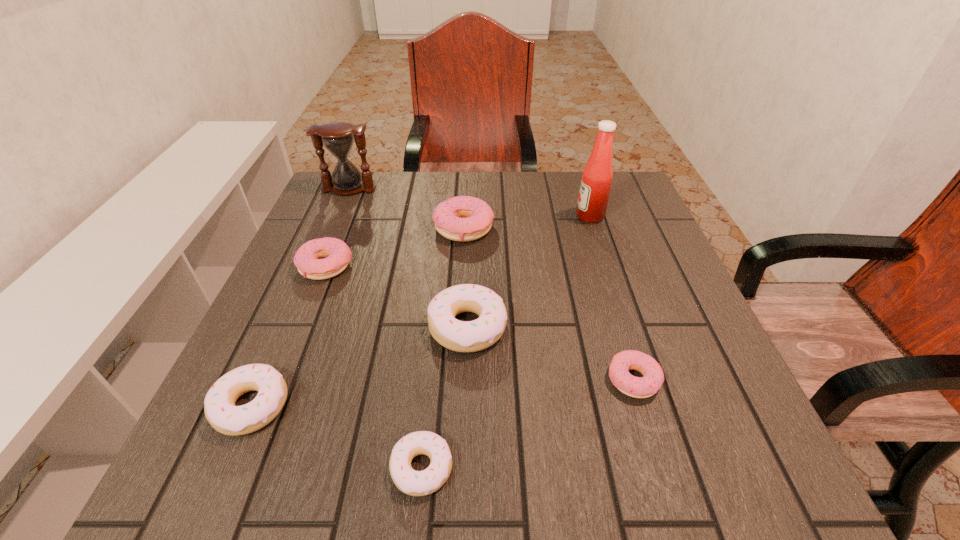
You are a GUI agent. You are given a task and a screenshot of the screen. Output one action in this format:
    pyautogui.click(x=<x>, y=<y>)
    Task: Click on the free space between the farthest white doughnut and the farthest doughnut
    The image size is (960, 540).
    Given the screenshot: What is the action you would take?
    [x=466, y=278]

The image size is (960, 540). What are the coordinates of `free spot between the second biggest white doughnut and the biggest white doughnut` in the screenshot? It's located at (359, 367).

Where is `free space that is in between the farthest white doughnut and the second pink doughnut from left to right`? The width and height of the screenshot is (960, 540). free space that is in between the farthest white doughnut and the second pink doughnut from left to right is located at coordinates (466, 278).

The image size is (960, 540). Identify the location of vacant space that is in between the nearest pink doughnut and the leftmost white doughnut. (443, 393).

Identify the location of object that is the third closest to the second biggest white doughnut. (337, 255).

Locate which object is the third closest to the nearest pink doughnut. Please provide its 2D coordinates. Your answer should be formatted as a tuple, i.e. [(x, y)], where the tuple contains the x and y coordinates of a point satisfying the conditions above.

[(463, 218)]

Point out which doughnut is positioned as the nearest to the smallest white doughnut. Please provide its 2D coordinates. Your answer should be formatted as a tuple, i.e. [(x, y)], where the tuple contains the x and y coordinates of a point satisfying the conditions above.

[(470, 336)]

Identify the location of doughnut object that ranks as the fourth closest to the seventh shortest object. Image resolution: width=960 pixels, height=540 pixels. (219, 405).

Locate which pink doughnut is the second closest to the leftmost white doughnut. Please provide its 2D coordinates. Your answer should be formatted as a tuple, i.e. [(x, y)], where the tuple contains the x and y coordinates of a point satisfying the conditions above.

[(463, 218)]

Locate an element on the screen. The width and height of the screenshot is (960, 540). pink doughnut that is the closest one to the tallest object is located at coordinates (463, 218).